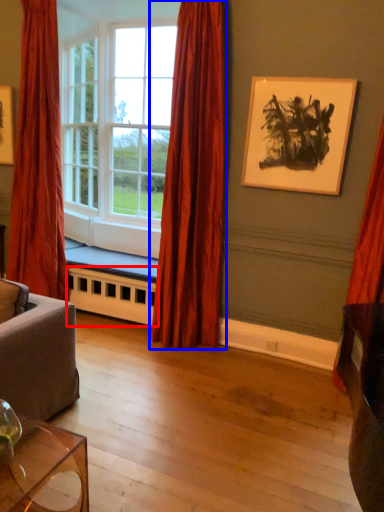
Question: Which object is closer to the camera taking this photo, radiator (highlighted by a red box) or curtain (highlighted by a blue box)?

Choices:
 (A) radiator
 (B) curtain

Answer: (B)